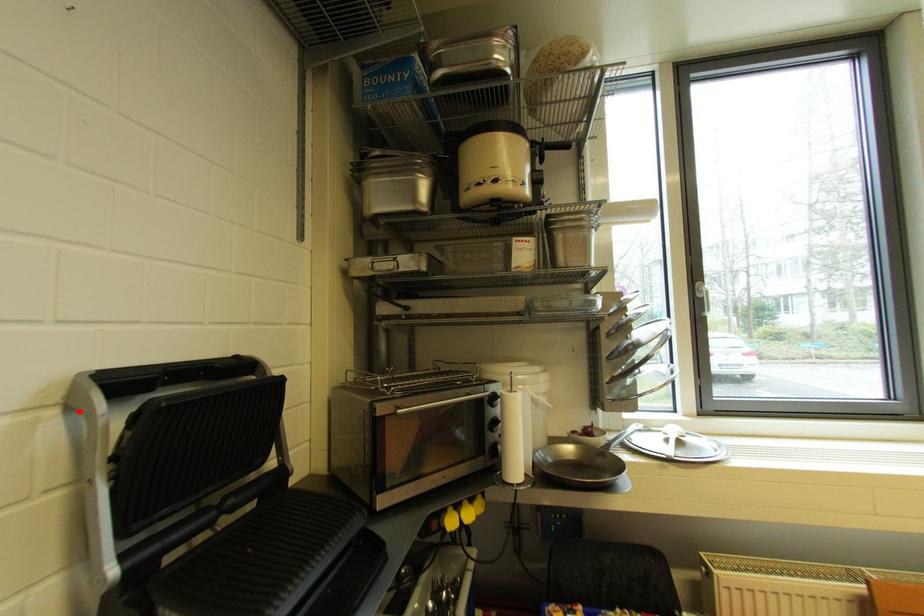
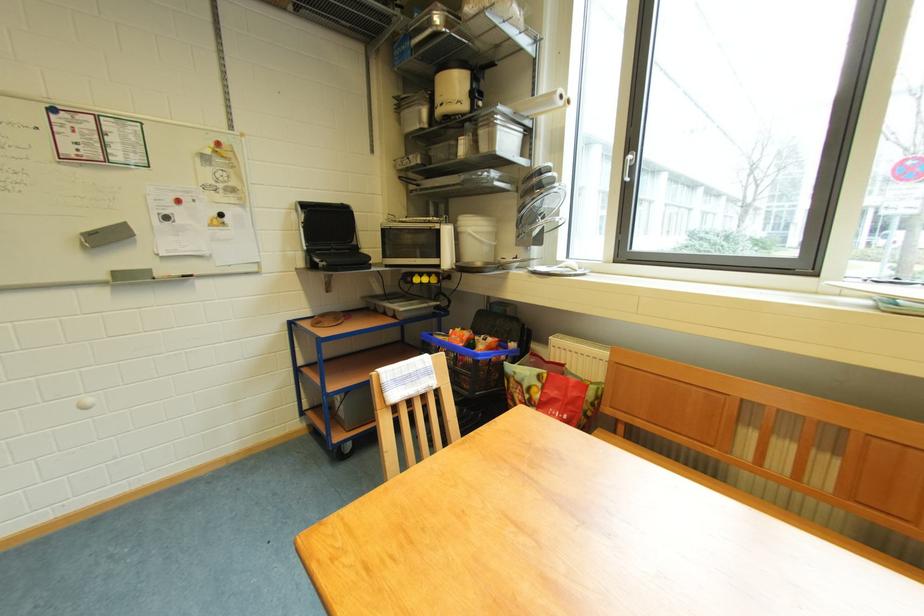
Question: I am providing you with two images of the same scene from different viewpoints. A red point is marked on the first image. At the location where the point appears in image 1, is it still visible in image 2?

Choices:
 (A) Yes
 (B) No

Answer: (A)